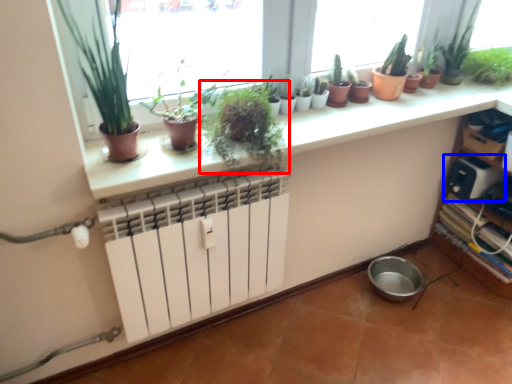
Question: Among these objects, which one is nearest to the camera, houseplant (highlighted by a red box) or appliance (highlighted by a blue box)?

Choices:
 (A) houseplant
 (B) appliance

Answer: (A)